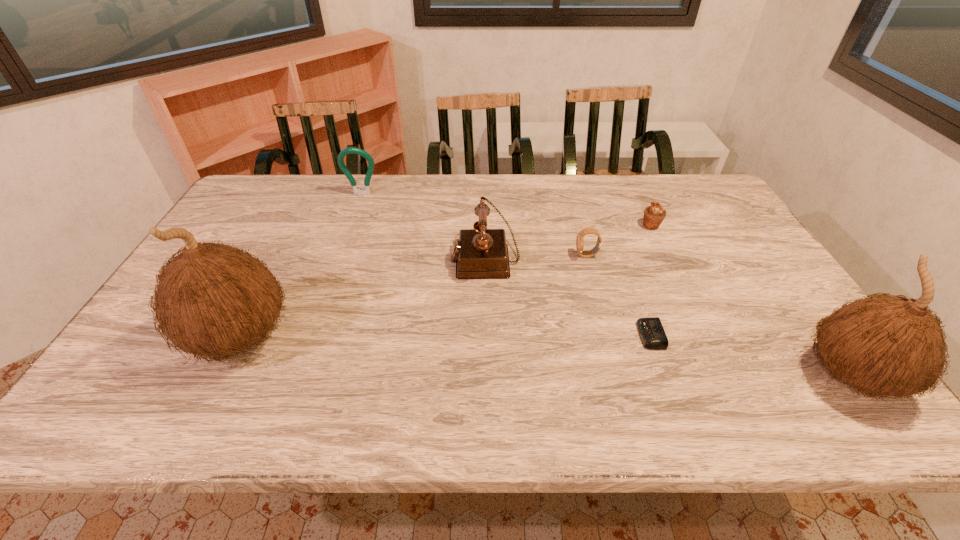
Where is `vacant position for inserting another coconut evenly`? The height and width of the screenshot is (540, 960). vacant position for inserting another coconut evenly is located at coordinates (534, 356).